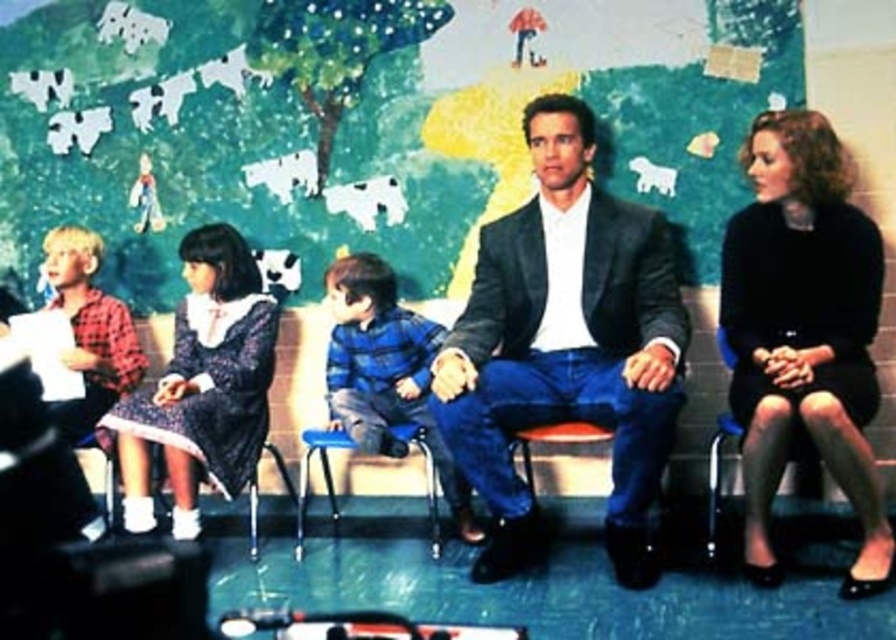
You are organizing a charity event and need to decide which outfit to display first. Based on the provided image, which of the two items, the matte black suit at center or the black matte dress at right, would you choose to place in the spotlight given their sizes?

The matte black suit at center is larger in size than the black matte dress at right, so it would be more suitable to place the matte black suit at center in the spotlight first as it is more visually prominent due to its size.

You are standing in the classroom scene. There is a point at coordinates (385, 372). Which object is this point located on?

The point at coordinates (385, 372) is located on the blue plaid shirt at center.